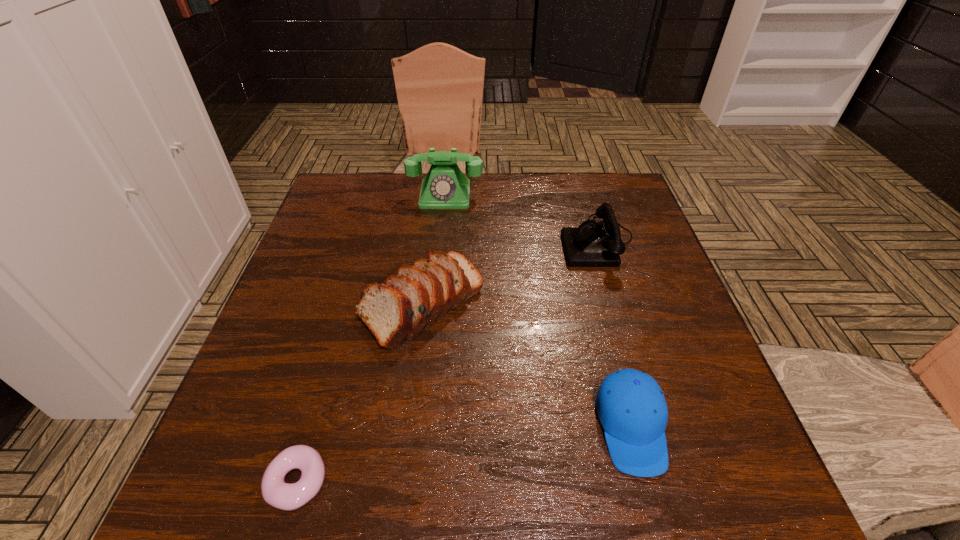
Locate an element on the screen. The image size is (960, 540). the left telephone is located at coordinates (445, 186).

Where is `the tallest object`? The image size is (960, 540). the tallest object is located at coordinates (445, 186).

You are a GUI agent. You are given a task and a screenshot of the screen. Output one action in this format:
    pyautogui.click(x=<x>, y=<y>)
    Task: Click on the right telephone
    
    Given the screenshot: What is the action you would take?
    pyautogui.click(x=592, y=244)

Identify the location of the nearer telephone. Image resolution: width=960 pixels, height=540 pixels. (592, 244).

Locate an element on the screen. This screenshot has width=960, height=540. bread is located at coordinates (398, 310).

I want to click on cap, so click(630, 405).

Where is `doughnut`? The width and height of the screenshot is (960, 540). doughnut is located at coordinates (277, 493).

The width and height of the screenshot is (960, 540). Identify the location of free spot located 0.070m on the dial of the tallest object. [x=443, y=225].

What are the coordinates of `free space located on the front face of the right telephone` in the screenshot? It's located at pos(441,241).

Where is `free space located on the front face of the right telephone`? The width and height of the screenshot is (960, 540). free space located on the front face of the right telephone is located at coordinates (539, 241).